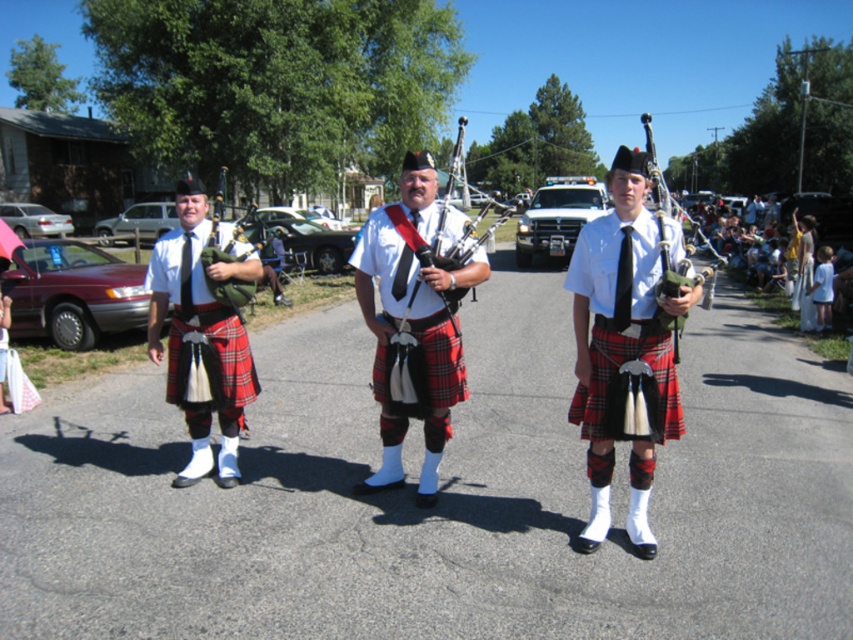
You are a photographer positioned at the center of the road in the image. You want to take a photo that includes both the point at (x=469, y=275) and the point at (x=459, y=168). Which point should you focus on first to ensure both are in the frame?

You should focus on the point at (x=459, y=168) first because it is behind the point at (x=469, y=275). By focusing on the farther point, both points will be in focus due to the depth of field.

From the picture: You are a photographer trying to capture a clear photo of the two objects at the center of the scene. Since the matte black kilt at center and the matte black bagpipes at center are both dark in color, which object should you focus on first to ensure it appears in the foreground?

The matte black kilt at center is not as tall as the matte black bagpipes at center, so the bagpipes will be taller and thus more likely to be in the foreground. Focus on the matte black bagpipes at center first to ensure it appears in the foreground.